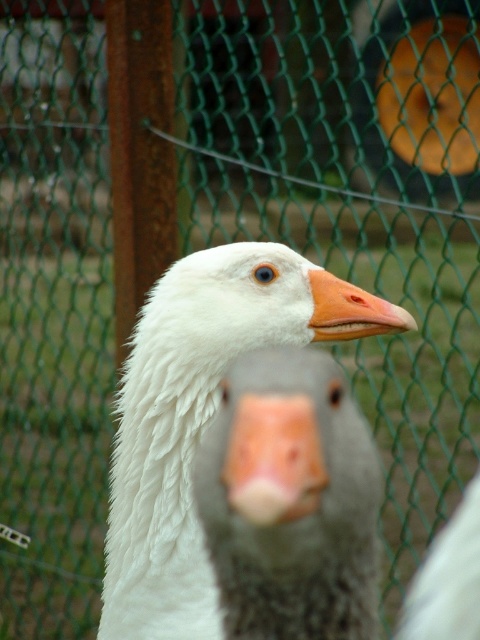
Does white matte duck at center have a lesser width compared to gray matte goose at center?

In fact, white matte duck at center might be wider than gray matte goose at center.

Can you confirm if white matte duck at center is positioned to the left of gray matte goose at center?

Correct, you'll find white matte duck at center to the left of gray matte goose at center.

The height and width of the screenshot is (640, 480). What do you see at coordinates (201, 417) in the screenshot? I see `white matte duck at center` at bounding box center [201, 417].

Identify the location of white matte duck at center. The image size is (480, 640). (201, 417).

Who is positioned more to the right, pink matte nose at center or matte gray goose at center?

matte gray goose at center is more to the right.

Is pink matte nose at center to the left of matte gray goose at center from the viewer's perspective?

Correct, you'll find pink matte nose at center to the left of matte gray goose at center.

Locate an element on the screen. The height and width of the screenshot is (640, 480). pink matte nose at center is located at coordinates (274, 458).

Find the location of a particular element. pink matte nose at center is located at coordinates (274, 458).

Does white matte duck at center have a larger size compared to matte gray goose at center?

Yes.

Who is higher up, white matte duck at center or matte gray goose at center?

Positioned higher is white matte duck at center.

Is point (352, 332) positioned after point (395, 636)?

No, it is not.

The height and width of the screenshot is (640, 480). I want to click on white matte duck at center, so click(x=201, y=417).